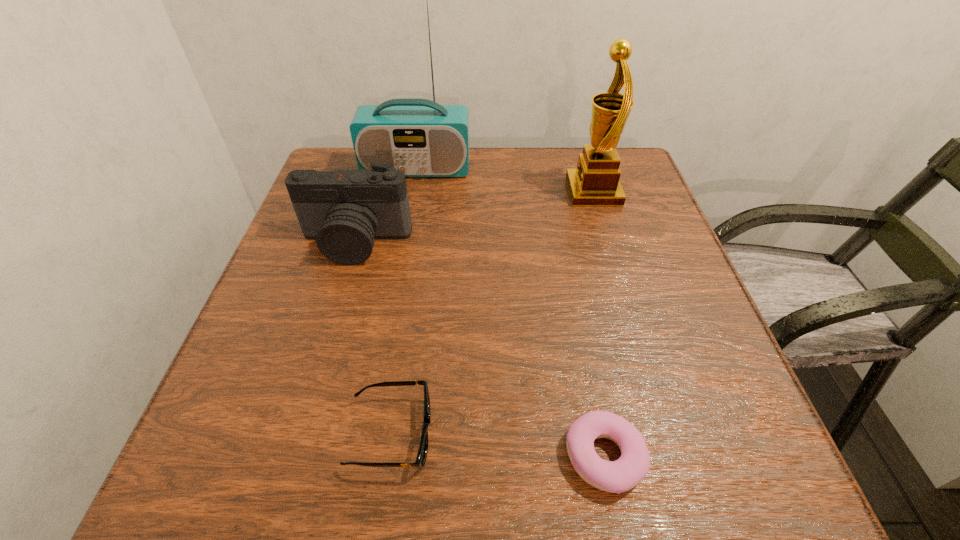
At what (x,y) coordinates should I click in order to perform the action: click on vacant space located 0.300m at the lens of the third farthest object. Please return your answer as a coordinate pair (x, y). Looking at the image, I should click on (309, 401).

The width and height of the screenshot is (960, 540). I want to click on free spot located on the front-facing side of the sunglasses, so click(602, 434).

What are the coordinates of `vacant space located on the back of the pastry` in the screenshot? It's located at (571, 288).

In order to click on radio receiver present at the far edge in this screenshot , I will do `click(422, 138)`.

The height and width of the screenshot is (540, 960). Identify the location of award that is at the far edge. 595,182.

I want to click on sunglasses at the near edge, so click(x=421, y=457).

At what (x,y) coordinates should I click in order to perform the action: click on pastry present at the near edge. Please return your answer as a coordinate pair (x, y). Looking at the image, I should click on (618, 476).

Locate an element on the screen. The height and width of the screenshot is (540, 960). radio receiver at the left edge is located at coordinates (422, 138).

Find the location of `camera situated at the left edge`. camera situated at the left edge is located at coordinates (344, 210).

At what (x,y) coordinates should I click in order to perform the action: click on object that is positioned at the right edge. Please return your answer as a coordinate pair (x, y). The height and width of the screenshot is (540, 960). Looking at the image, I should click on (595, 182).